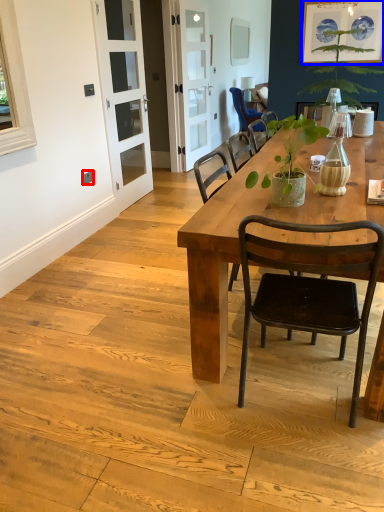
Question: Which object is closer to the camera taking this photo, power outlet (highlighted by a red box) or picture frame (highlighted by a blue box)?

Choices:
 (A) power outlet
 (B) picture frame

Answer: (A)